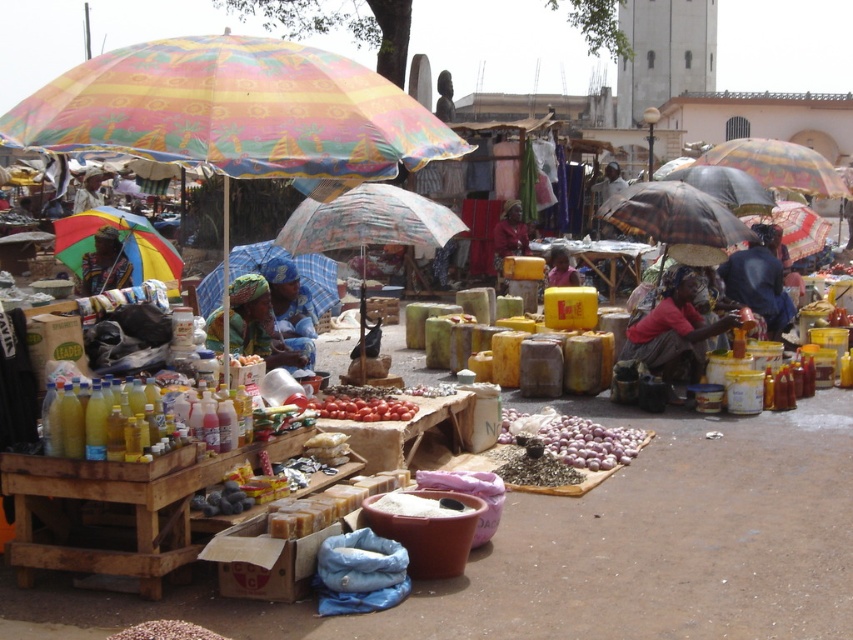
You are a customer at the market and want to buy an item that can provide shade from the sun. Which item between the multicolored fabric umbrella at center and the matte fabric headscarf at center would be more suitable for that purpose?

The multicolored fabric umbrella at center is taller than the matte fabric headscarf at center, making it more suitable for providing shade from the sun.

You are a customer at the market and want to buy an item that can provide shade. You see the multicolored fabric umbrella at center and the matte fabric headscarf at center. Which item is more suitable for blocking sunlight?

The multicolored fabric umbrella at center is wider than the matte fabric headscarf at center, so it is more suitable for blocking sunlight.